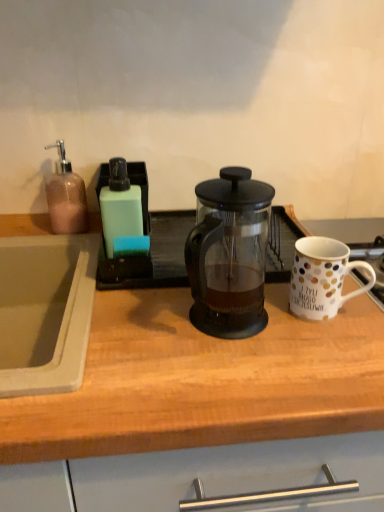
Question: Can you confirm if white polka dot ceramic mug at right is smaller than transparent glass french press at center?

Choices:
 (A) yes
 (B) no

Answer: (A)

Question: Is transparent glass french press at center surrounded by white polka dot ceramic mug at right?

Choices:
 (A) no
 (B) yes

Answer: (A)

Question: Is white polka dot ceramic mug at right oriented away from transparent glass french press at center?

Choices:
 (A) yes
 (B) no

Answer: (B)

Question: Is white polka dot ceramic mug at right outside of transparent glass french press at center?

Choices:
 (A) no
 (B) yes

Answer: (B)

Question: Considering the relative sizes of white polka dot ceramic mug at right and transparent glass french press at center in the image provided, is white polka dot ceramic mug at right taller than transparent glass french press at center?

Choices:
 (A) no
 (B) yes

Answer: (A)

Question: Looking at the image, does transparent glass french press at center seem bigger or smaller compared to transparent glass french press at center?

Choices:
 (A) big
 (B) small

Answer: (A)

Question: Considering the positions of point (302, 403) and point (243, 259), is point (302, 403) closer or farther from the camera than point (243, 259)?

Choices:
 (A) farther
 (B) closer

Answer: (B)

Question: In the image, is transparent glass french press at center on the left side or the right side of transparent glass french press at center?

Choices:
 (A) left
 (B) right

Answer: (B)

Question: In terms of width, does transparent glass french press at center look wider or thinner when compared to transparent glass french press at center?

Choices:
 (A) wide
 (B) thin

Answer: (A)

Question: Do you think transparent glass french press at center is within white polka dot ceramic mug at right, or outside of it?

Choices:
 (A) outside
 (B) inside

Answer: (A)

Question: From a real-world perspective, relative to white polka dot ceramic mug at right, is transparent glass french press at center vertically above or below?

Choices:
 (A) above
 (B) below

Answer: (A)

Question: Considering the positions of transparent glass french press at center and white polka dot ceramic mug at right in the image, is transparent glass french press at center bigger or smaller than white polka dot ceramic mug at right?

Choices:
 (A) small
 (B) big

Answer: (B)

Question: From the image's perspective, is transparent glass french press at center above or below white polka dot ceramic mug at right?

Choices:
 (A) below
 (B) above

Answer: (B)

Question: Is white polka dot ceramic mug at right taller or shorter than transparent glass french press at center?

Choices:
 (A) tall
 (B) short

Answer: (B)

Question: From a real-world perspective, is white polka dot ceramic mug at right physically located above or below transparent glass french press at center?

Choices:
 (A) below
 (B) above

Answer: (A)